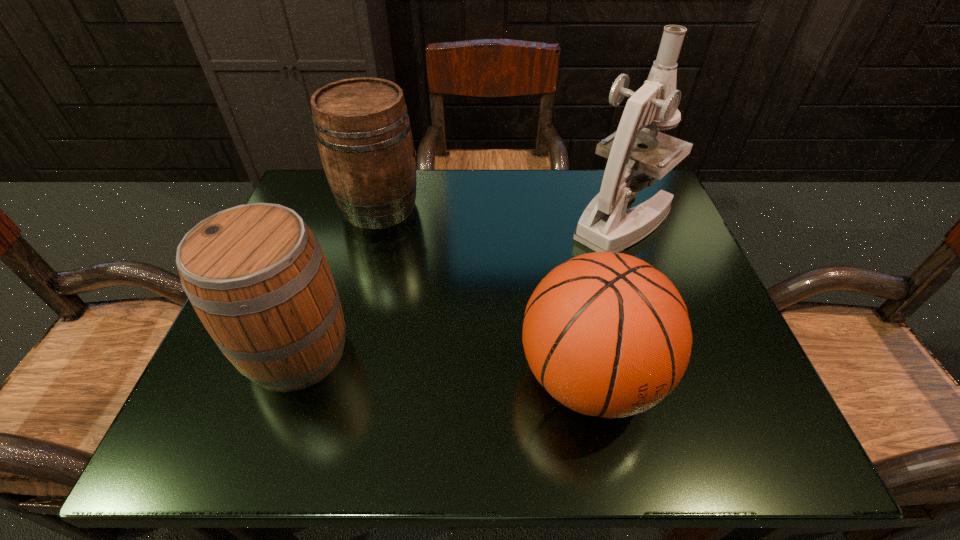
The image size is (960, 540). Find the location of `microscope`. microscope is located at coordinates (605, 225).

At what (x,y) coordinates should I click in order to perform the action: click on the farther cider. Please return your answer as a coordinate pair (x, y). Image resolution: width=960 pixels, height=540 pixels. Looking at the image, I should click on (363, 132).

At what (x,y) coordinates should I click in order to perform the action: click on the nearer cider. Please return your answer as a coordinate pair (x, y). Looking at the image, I should click on (255, 274).

Where is `basketball`? The height and width of the screenshot is (540, 960). basketball is located at coordinates (606, 334).

The width and height of the screenshot is (960, 540). Identify the location of free region located 0.290m on the left of the microscope. (444, 221).

The height and width of the screenshot is (540, 960). Identify the location of free region located 0.380m on the side of the farther cider near the bung hole. (580, 206).

Locate an element on the screen. The image size is (960, 540). vacant space located on the back of the nearer cider is located at coordinates (326, 268).

Locate an element on the screen. vacant space located on the back of the basketball is located at coordinates (572, 293).

Find the location of a particular element. The image size is (960, 540). microscope that is at the far edge is located at coordinates (605, 225).

Identify the location of cider that is at the far edge. (363, 132).